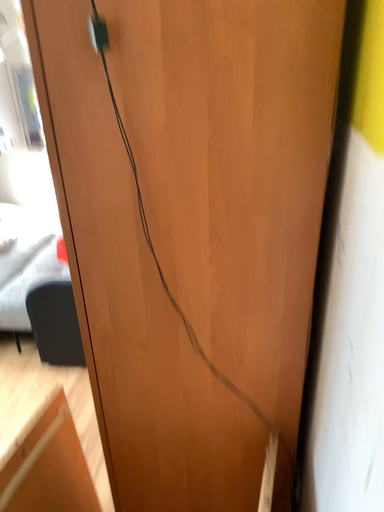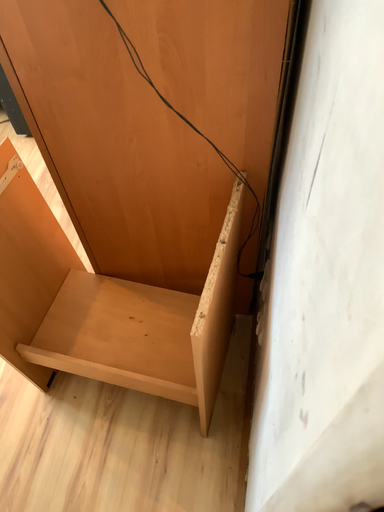
Question: Which way did the camera rotate in the video?

Choices:
 (A) rotated downward
 (B) rotated upward

Answer: (A)